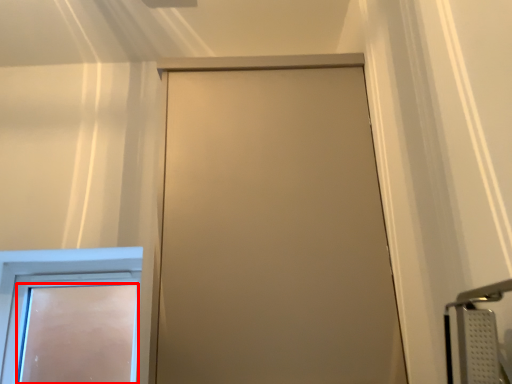
Question: In this image, where is door (annotated by the red box) located relative to door?

Choices:
 (A) right
 (B) left

Answer: (B)